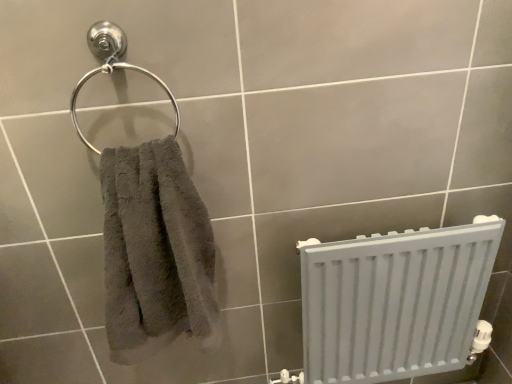
Question: Should I look upward or downward to see white matte radiator at lower right?

Choices:
 (A) up
 (B) down

Answer: (B)

Question: Can you confirm if satin chrome towel ring at upper left is wider than gray fluffy towel at left?

Choices:
 (A) yes
 (B) no

Answer: (B)

Question: Is satin chrome towel ring at upper left in front of gray fluffy towel at left?

Choices:
 (A) yes
 (B) no

Answer: (B)

Question: Is satin chrome towel ring at upper left directly adjacent to gray fluffy towel at left?

Choices:
 (A) no
 (B) yes

Answer: (A)

Question: Is satin chrome towel ring at upper left oriented away from gray fluffy towel at left?

Choices:
 (A) no
 (B) yes

Answer: (A)

Question: Is satin chrome towel ring at upper left facing towards gray fluffy towel at left?

Choices:
 (A) no
 (B) yes

Answer: (A)

Question: Is satin chrome towel ring at upper left smaller than gray fluffy towel at left?

Choices:
 (A) yes
 (B) no

Answer: (A)

Question: Is gray fluffy towel at left a part of white matte radiator at lower right?

Choices:
 (A) no
 (B) yes

Answer: (A)

Question: Can we say white matte radiator at lower right lies outside gray fluffy towel at left?

Choices:
 (A) yes
 (B) no

Answer: (A)

Question: Can you confirm if white matte radiator at lower right is taller than gray fluffy towel at left?

Choices:
 (A) no
 (B) yes

Answer: (B)

Question: Does white matte radiator at lower right have a lesser height compared to gray fluffy towel at left?

Choices:
 (A) yes
 (B) no

Answer: (B)

Question: Is white matte radiator at lower right at the left side of gray fluffy towel at left?

Choices:
 (A) yes
 (B) no

Answer: (B)

Question: Considering the relative sizes of white matte radiator at lower right and gray fluffy towel at left in the image provided, is white matte radiator at lower right bigger than gray fluffy towel at left?

Choices:
 (A) yes
 (B) no

Answer: (A)

Question: Are satin chrome towel ring at upper left and white matte radiator at lower right far apart?

Choices:
 (A) no
 (B) yes

Answer: (A)